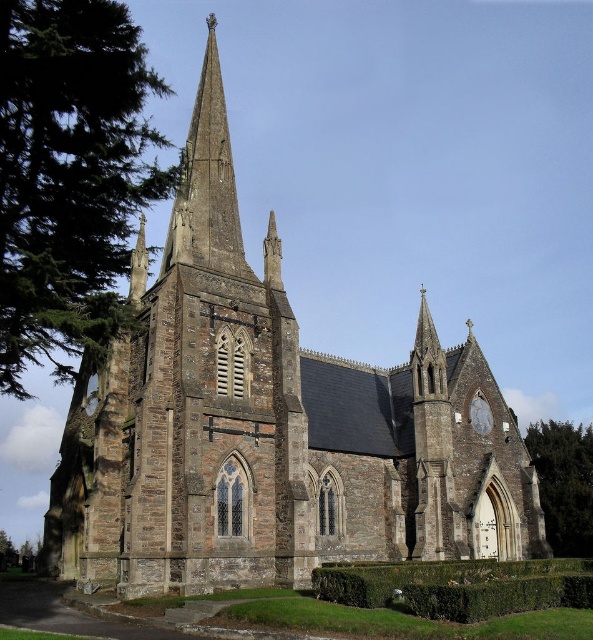
Question: Is green leafy tree at upper left below green leafy tree at lower right?

Choices:
 (A) yes
 (B) no

Answer: (B)

Question: Which object is closer to the camera taking this photo?

Choices:
 (A) smooth stone spire at upper center
 (B) green leafy tree at lower right

Answer: (A)

Question: Is the position of green leafy tree at lower right more distant than that of white stone clock at upper right?

Choices:
 (A) yes
 (B) no

Answer: (A)

Question: Among these objects, which one is farthest from the camera?

Choices:
 (A) white stone clock at upper right
 (B) green leafy tree at upper left

Answer: (A)

Question: Can you confirm if green leafy tree at lower right is thinner than white stone clock at upper right?

Choices:
 (A) yes
 (B) no

Answer: (B)

Question: Which object appears closest to the camera in this image?

Choices:
 (A) green leafy tree at upper left
 (B) smooth stone spire at upper center
 (C) green leafy tree at lower right
 (D) white stone clock at upper right

Answer: (A)